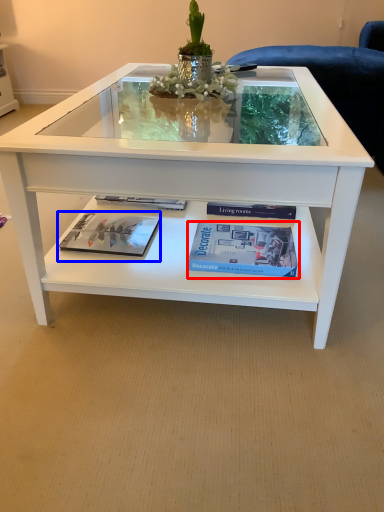
Question: Which of the following is the closest to the observer, paperback book (highlighted by a red box) or magazine (highlighted by a blue box)?

Choices:
 (A) paperback book
 (B) magazine

Answer: (A)